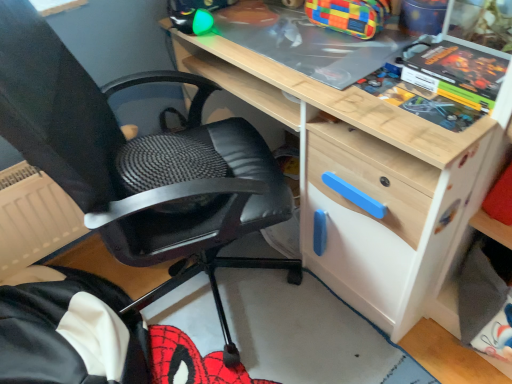
The image size is (512, 384). I want to click on black leather chair at center, so click(x=138, y=162).

What do you see at coordinates (138, 162) in the screenshot?
I see `black leather chair at center` at bounding box center [138, 162].

Measure the distance between point (153, 166) and camera.

The depth of point (153, 166) is 3.58 feet.

I want to click on matt black comic book at upper right, so click(455, 72).

What do you see at coordinates (455, 72) in the screenshot?
I see `matt black comic book at upper right` at bounding box center [455, 72].

Looking at this image, measure the distance between point [422,70] and camera.

Point [422,70] and camera are 37.48 inches apart.

The height and width of the screenshot is (384, 512). What are the coordinates of `black leather chair at center` in the screenshot? It's located at (138, 162).

Visually, is black leather chair at center positioned to the left or to the right of matt black comic book at upper right?

black leather chair at center is to the left of matt black comic book at upper right.

Which object is closer to the camera, black leather chair at center or matt black comic book at upper right?

black leather chair at center is in front.

Between point (62, 55) and point (438, 81), which one is positioned behind?

The point (62, 55) is farther.

From the picture: From the image's perspective, which one is positioned lower, black leather chair at center or matt black comic book at upper right?

black leather chair at center appears lower in the image.

From a real-world perspective, which is physically below, black leather chair at center or matt black comic book at upper right?

From a 3D spatial view, black leather chair at center is below.

Looking at their sizes, would you say black leather chair at center is wider or thinner than matt black comic book at upper right?

In the image, black leather chair at center appears to be wider than matt black comic book at upper right.

Considering the relative sizes of black leather chair at center and matt black comic book at upper right in the image provided, is black leather chair at center taller than matt black comic book at upper right?

Yes, black leather chair at center is taller than matt black comic book at upper right.

Is black leather chair at center bigger or smaller than matt black comic book at upper right?

In the image, black leather chair at center appears to be larger than matt black comic book at upper right.

Is matt black comic book at upper right surrounded by black leather chair at center?

No, black leather chair at center does not contain matt black comic book at upper right.

Is black leather chair at center positioned far away from matt black comic book at upper right?

No, black leather chair at center is in close proximity to matt black comic book at upper right.

Is matt black comic book at upper right at the back of black leather chair at center?

That's not correct — black leather chair at center is not looking away from matt black comic book at upper right.

How many degrees apart are the facing directions of black leather chair at center and matt black comic book at upper right?

The facing directions of black leather chair at center and matt black comic book at upper right are 148 degrees apart.

Locate an element on the screen. The height and width of the screenshot is (384, 512). comic book to the right of black leather chair at center is located at coordinates (455, 72).

Is matt black comic book at upper right at the left side of black leather chair at center?

In fact, matt black comic book at upper right is to the right of black leather chair at center.

Which object is further away from the camera taking this photo, matt black comic book at upper right or black leather chair at center?

matt black comic book at upper right.

Does point (482, 110) come closer to viewer compared to point (138, 180)?

Yes, point (482, 110) is in front of point (138, 180).

From the image's perspective, relative to black leather chair at center, is matt black comic book at upper right above or below?

From the image's perspective, matt black comic book at upper right appears above black leather chair at center.

From a real-world perspective, is matt black comic book at upper right positioned over black leather chair at center based on gravity?

Yes, from a real-world perspective, matt black comic book at upper right is on top of black leather chair at center.

Is matt black comic book at upper right wider than black leather chair at center?

No, matt black comic book at upper right is not wider than black leather chair at center.

Which of these two, matt black comic book at upper right or black leather chair at center, stands taller?

With more height is black leather chair at center.

Considering the sizes of objects matt black comic book at upper right and black leather chair at center in the image provided, who is smaller, matt black comic book at upper right or black leather chair at center?

matt black comic book at upper right is smaller.

Would you say matt black comic book at upper right contains black leather chair at center?

No.

Is matt black comic book at upper right directly adjacent to black leather chair at center?

No, matt black comic book at upper right is not with black leather chair at center.

In the scene shown: Is matt black comic book at upper right positioned with its back to black leather chair at center?

No, matt black comic book at upper right's orientation is not away from black leather chair at center.

This screenshot has height=384, width=512. Identify the location of chair beneath the matt black comic book at upper right (from a real-world perspective). (138, 162).

You are a GUI agent. You are given a task and a screenshot of the screen. Output one action in this format:
    pyautogui.click(x=<x>, y=<y>)
    Task: Click on the comic book on the right side of black leather chair at center
    This screenshot has height=384, width=512.
    Given the screenshot: What is the action you would take?
    pyautogui.click(x=455, y=72)

Where is `comic book above the black leather chair at center (from the image's perspective)`? This screenshot has height=384, width=512. comic book above the black leather chair at center (from the image's perspective) is located at coordinates (455, 72).